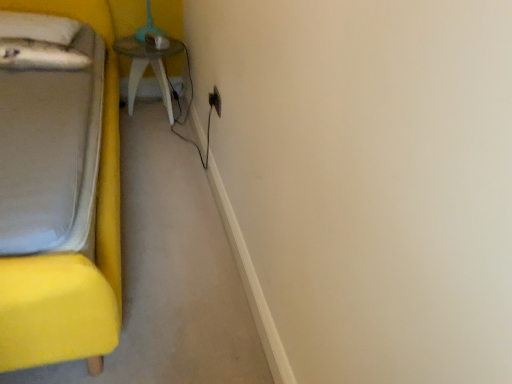
Question: Is white soft pillow at upper left positioned far away from black plastic electric outlet at upper center?

Choices:
 (A) yes
 (B) no

Answer: (B)

Question: Considering the relative positions of white soft pillow at upper left and black plastic electric outlet at upper center in the image provided, is white soft pillow at upper left behind black plastic electric outlet at upper center?

Choices:
 (A) yes
 (B) no

Answer: (A)

Question: Is white soft pillow at upper left next to black plastic electric outlet at upper center and touching it?

Choices:
 (A) yes
 (B) no

Answer: (B)

Question: Is black plastic electric outlet at upper center inside white soft pillow at upper left?

Choices:
 (A) yes
 (B) no

Answer: (B)

Question: Is white soft pillow at upper left shorter than black plastic electric outlet at upper center?

Choices:
 (A) yes
 (B) no

Answer: (B)

Question: Would you say yellow fabric bed at left is to the left or to the right of wooden table at center in the picture?

Choices:
 (A) right
 (B) left

Answer: (B)

Question: From a real-world perspective, is yellow fabric bed at left positioned above or below wooden table at center?

Choices:
 (A) below
 (B) above

Answer: (B)

Question: Considering the positions of point (114, 211) and point (162, 49), is point (114, 211) closer or farther from the camera than point (162, 49)?

Choices:
 (A) closer
 (B) farther

Answer: (A)

Question: From the image's perspective, is yellow fabric bed at left located above or below wooden table at center?

Choices:
 (A) above
 (B) below

Answer: (B)

Question: Is wooden table at center to the left or to the right of white soft pillow at upper left in the image?

Choices:
 (A) left
 (B) right

Answer: (B)

Question: From a real-world perspective, is wooden table at center above or below white soft pillow at upper left?

Choices:
 (A) below
 (B) above

Answer: (A)

Question: Is wooden table at center taller or shorter than white soft pillow at upper left?

Choices:
 (A) tall
 (B) short

Answer: (A)

Question: Which is correct: wooden table at center is inside white soft pillow at upper left, or outside of it?

Choices:
 (A) inside
 (B) outside

Answer: (B)

Question: From a real-world perspective, relative to black plastic electric outlet at upper center, is white soft pillow at upper left vertically above or below?

Choices:
 (A) below
 (B) above

Answer: (B)

Question: Relative to black plastic electric outlet at upper center, is white soft pillow at upper left in front or behind?

Choices:
 (A) behind
 (B) front

Answer: (A)